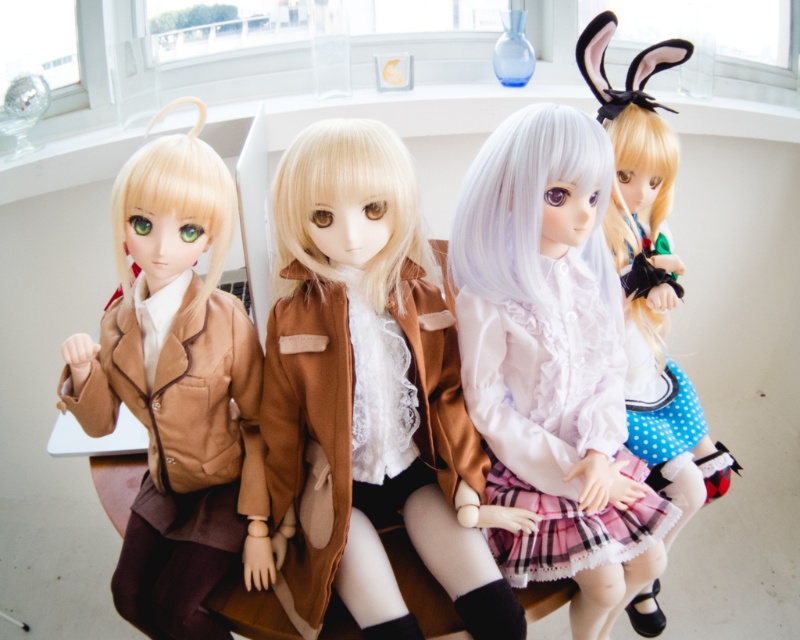
You are a toy organizer who needs to stack the matte brown jacket at left and the white matte wig at upper right vertically. Which object should be placed at the bottom to ensure stability?

The matte brown jacket at left should be placed at the bottom since it is shorter than the white matte wig at upper right, allowing the taller wig to be placed on top for stability.

Where is the matte white wig at center located in the image?

The matte white wig at center is located at point 0.562 on the horizontal axis and 0.689 on the vertical axis.